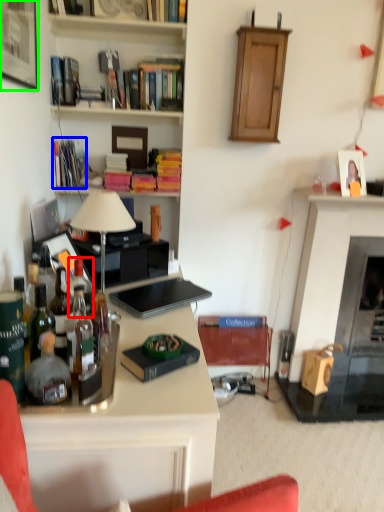
Question: Which is farther away from bottle (highlighted by a red box)? book (highlighted by a blue box) or picture frame (highlighted by a green box)?

Choices:
 (A) book
 (B) picture frame

Answer: (A)